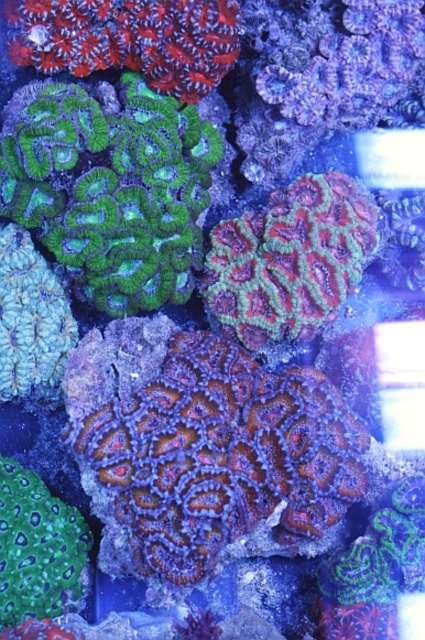
From the picture: Does textured coral at center appear over green textured coral at center?

No, textured coral at center is not above green textured coral at center.

Describe the element at coordinates (204, 449) in the screenshot. I see `textured coral at center` at that location.

Identify the location of textured coral at center. This screenshot has width=425, height=640. (204, 449).

Does green textured coral at center have a greater height compared to green textured coral at lower left?

Yes, green textured coral at center is taller than green textured coral at lower left.

Is green textured coral at center positioned before green textured coral at lower left?

No, green textured coral at center is behind green textured coral at lower left.

Is point (345, 209) closer to viewer compared to point (71, 545)?

No, (345, 209) is behind (71, 545).

In order to click on green textured coral at center in this screenshot , I will do `click(289, 259)`.

Between textured coral at center and green textured coral at lower left, which one has more height?

textured coral at center is taller.

In the scene shown: Is textured coral at center smaller than green textured coral at lower left?

Incorrect, textured coral at center is not smaller in size than green textured coral at lower left.

Where is `textured coral at center`? The width and height of the screenshot is (425, 640). textured coral at center is located at coordinates (204, 449).